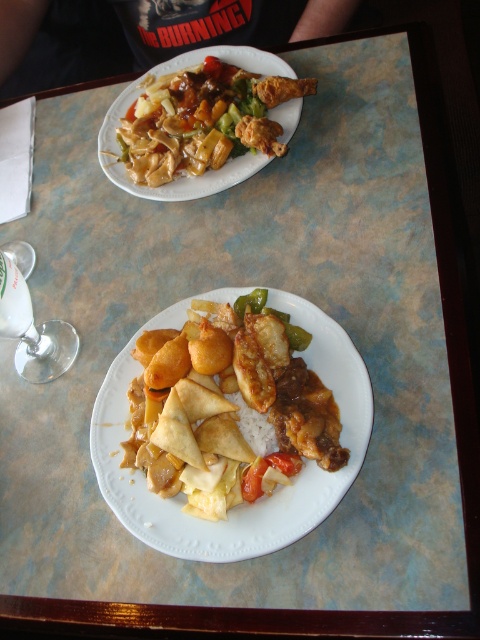
This screenshot has width=480, height=640. What are the coordinates of `clear glass wine glass at lower left` in the screenshot? It's located at (x=33, y=330).

Is clear glass wine glass at lower left to the left of white matte rice at center from the viewer's perspective?

Indeed, clear glass wine glass at lower left is positioned on the left side of white matte rice at center.

Which is in front, point (38, 336) or point (237, 396)?

Point (237, 396) is more forward.

This screenshot has height=640, width=480. I want to click on clear glass wine glass at lower left, so click(33, 330).

Can you confirm if shiny brown chicken at upper left is wider than white matte rice at center?

Yes.

Is shiny brown chicken at upper left bigger than white matte rice at center?

Yes.

What are the coordinates of `shiny brown chicken at upper left` in the screenshot? It's located at (203, 120).

Who is more distant from viewer, (x=130, y=339) or (x=256, y=301)?

Positioned behind is point (x=130, y=339).

Does white matte plate at center appear on the right side of green glossy bell pepper at center?

In fact, white matte plate at center is to the left of green glossy bell pepper at center.

Does point (280, 488) lie in front of point (285, 323)?

That is True.

The height and width of the screenshot is (640, 480). I want to click on white matte plate at center, so click(241, 502).